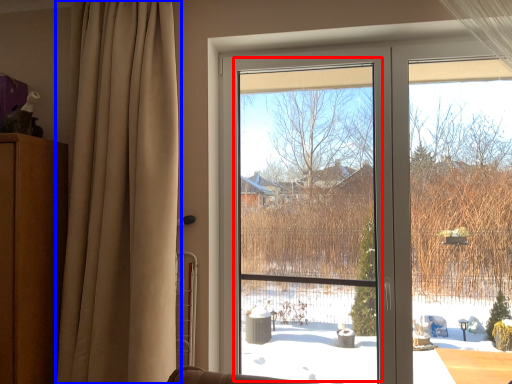
Question: Which of the following is the closest to the observer, window screen (highlighted by a red box) or curtain (highlighted by a blue box)?

Choices:
 (A) window screen
 (B) curtain

Answer: (B)